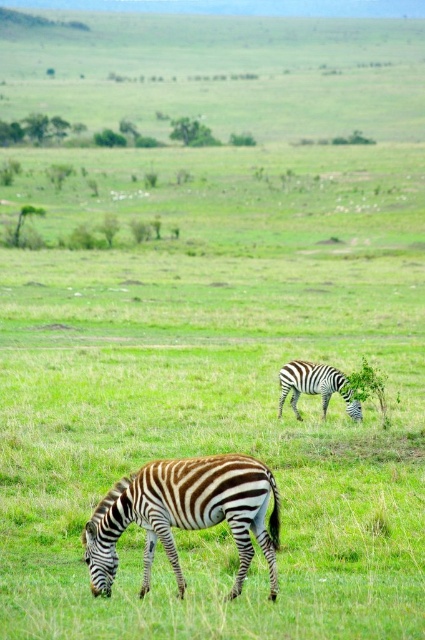
Question: Does brown and white striped zebra at lower center appear on the left side of black and white striped zebra at center?

Choices:
 (A) yes
 (B) no

Answer: (A)

Question: Can you confirm if brown and white striped zebra at lower center is smaller than black and white striped zebra at center?

Choices:
 (A) yes
 (B) no

Answer: (A)

Question: Does brown and white striped zebra at lower center have a larger size compared to black and white striped zebra at center?

Choices:
 (A) yes
 (B) no

Answer: (B)

Question: Which point appears farthest from the camera in this image?

Choices:
 (A) (238, 552)
 (B) (297, 369)

Answer: (B)

Question: Which point is farther from the camera taking this photo?

Choices:
 (A) pos(288,384)
 (B) pos(125,506)

Answer: (A)